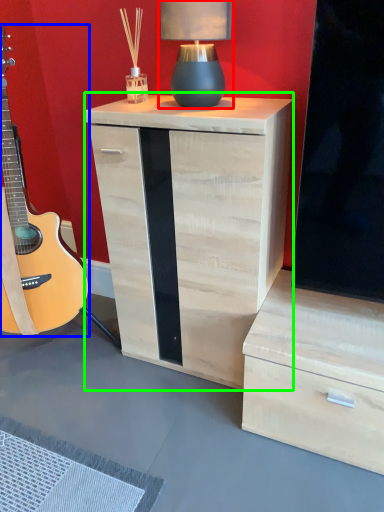
Question: Which is nearer to the table lamp (highlighted by a red box)? guitar (highlighted by a blue box) or nightstand (highlighted by a green box).

Choices:
 (A) guitar
 (B) nightstand

Answer: (B)